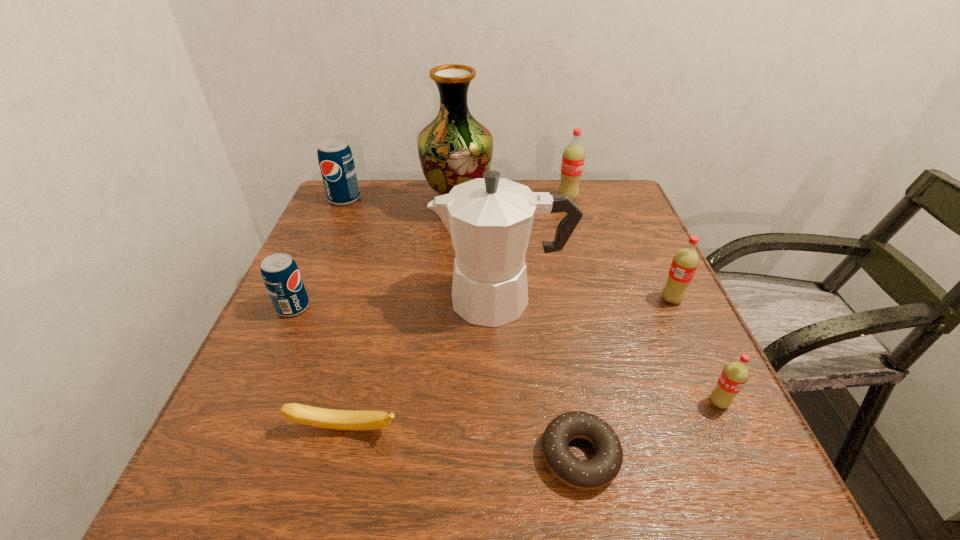
Where is `vacant space that is in between the second nearest red soda and the seventh farthest object`? This screenshot has height=540, width=960. vacant space that is in between the second nearest red soda and the seventh farthest object is located at coordinates (695, 351).

The height and width of the screenshot is (540, 960). What are the coordinates of `free space between the smaller blue pop and the yellow banana` in the screenshot? It's located at (320, 368).

Where is `vacant area that lies between the gray coffeepot and the nearest soda`? The height and width of the screenshot is (540, 960). vacant area that lies between the gray coffeepot and the nearest soda is located at coordinates (611, 351).

Where is `free space between the nearer blue pop and the nearest soda`? This screenshot has width=960, height=540. free space between the nearer blue pop and the nearest soda is located at coordinates (506, 355).

Where is `free area in between the yellow banana and the gray coffeepot`? free area in between the yellow banana and the gray coffeepot is located at coordinates (423, 364).

Find the location of a particular element. This screenshot has width=960, height=540. free point between the tallest soda and the nearest soda is located at coordinates (643, 301).

Select which object is the second closest to the eighth tallest object. Please provide its 2D coordinates. Your answer should be formatted as a tuple, i.e. [(x, y)], where the tuple contains the x and y coordinates of a point satisfying the conditions above.

[(595, 473)]

Select which object is the second closest to the brown doughnut. Please provide its 2D coordinates. Your answer should be formatted as a tuple, i.e. [(x, y)], where the tuple contains the x and y coordinates of a point satisfying the conditions above.

[(490, 219)]

Find the location of `soda identified as the closest to the second smallest red soda`. soda identified as the closest to the second smallest red soda is located at coordinates (734, 376).

Select which soda is the second closest to the eighth shortest object. Please provide its 2D coordinates. Your answer should be formatted as a tuple, i.e. [(x, y)], where the tuple contains the x and y coordinates of a point satisfying the conditions above.

[(734, 376)]